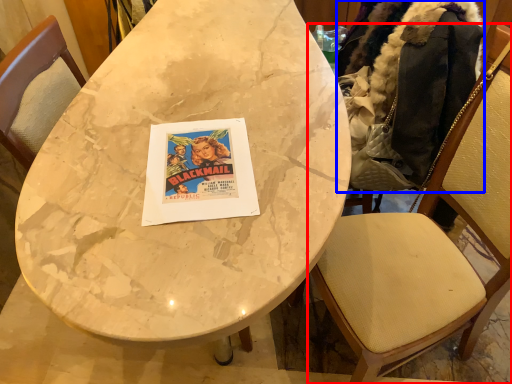
Question: Among these objects, which one is nearest to the camera, chair (highlighted by a red box) or jacket (highlighted by a blue box)?

Choices:
 (A) chair
 (B) jacket

Answer: (A)